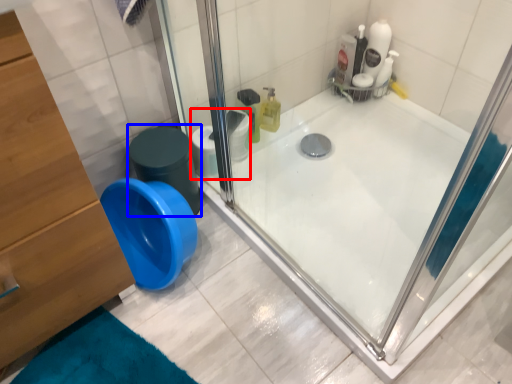
Question: Which point is closer to the camera, toilet paper (highlighted by a red box) or potty (highlighted by a blue box)?

Choices:
 (A) toilet paper
 (B) potty

Answer: (B)